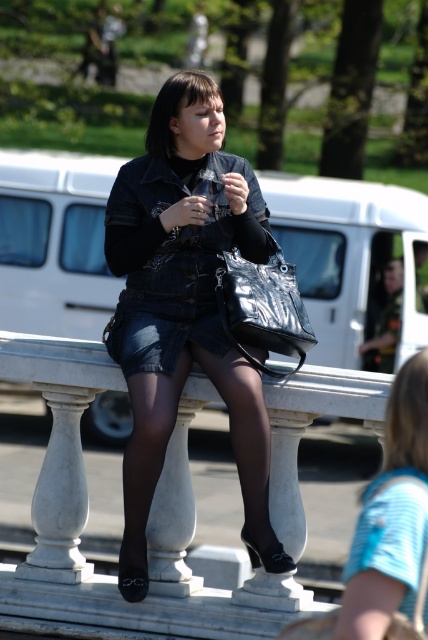
Does point (89, 262) come farther from viewer compared to point (226, 252)?

Yes, it is.

Who is more forward, (107, 412) or (246, 358)?

Point (246, 358)

Which is in front, point (23, 234) or point (297, 326)?

Point (297, 326) is more forward.

Image resolution: width=428 pixels, height=640 pixels. In order to click on white matte van at upper center in this screenshot , I will do `click(347, 256)`.

Between point (278, 544) and point (244, 369), which one is positioned behind?

The point (244, 369) is behind.

In order to click on denim skirt at center in this screenshot , I will do `click(184, 308)`.

Does point (184, 349) lie in front of point (152, 340)?

No, it is behind (152, 340).

Can you confirm if denim skirt at center is wider than denim shorts at center?

Indeed, denim skirt at center has a greater width compared to denim shorts at center.

Between point (133, 524) and point (211, 353), which one is positioned behind?

Point (211, 353)

I want to click on denim skirt at center, so click(184, 308).